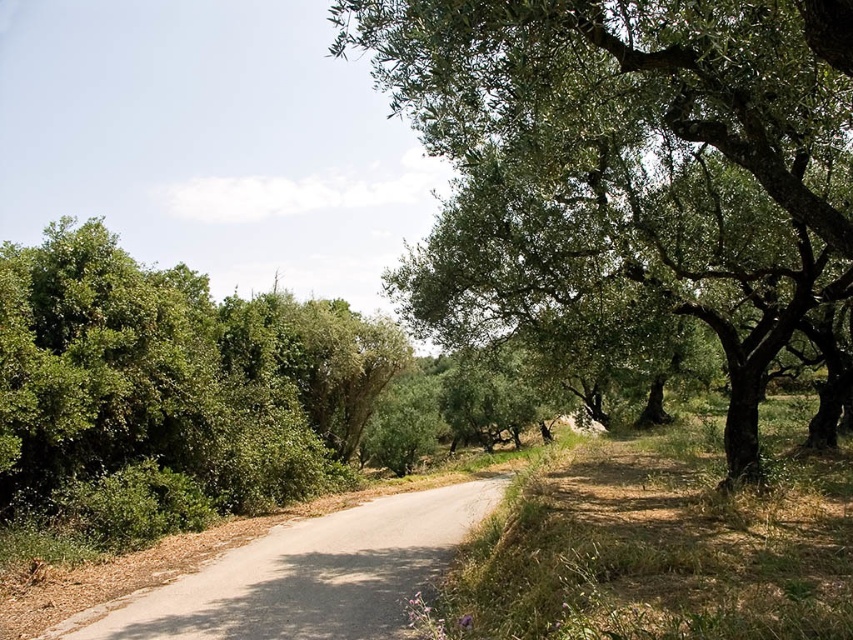
Question: Is green leafy tree at center thinner than green leafy bush at left?

Choices:
 (A) yes
 (B) no

Answer: (B)

Question: Considering the real-world distances, which object is farthest from the green leafy bush at left?

Choices:
 (A) green leafy tree at center
 (B) gray asphalt road at center

Answer: (A)

Question: In this image, where is green leafy tree at center located relative to gray asphalt road at center?

Choices:
 (A) above
 (B) below

Answer: (A)

Question: Which point appears closest to the camera in this image?

Choices:
 (A) (314, 314)
 (B) (381, 532)
 (C) (498, 275)

Answer: (C)

Question: Among these points, which one is farthest from the camera?

Choices:
 (A) (825, 12)
 (B) (253, 321)

Answer: (B)

Question: Is green leafy tree at center bigger than gray asphalt road at center?

Choices:
 (A) no
 (B) yes

Answer: (B)